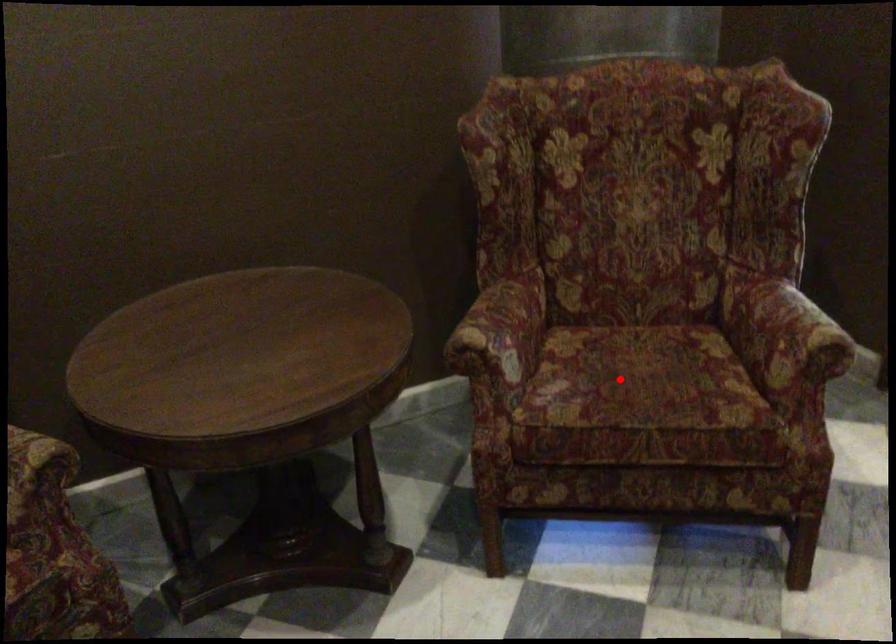
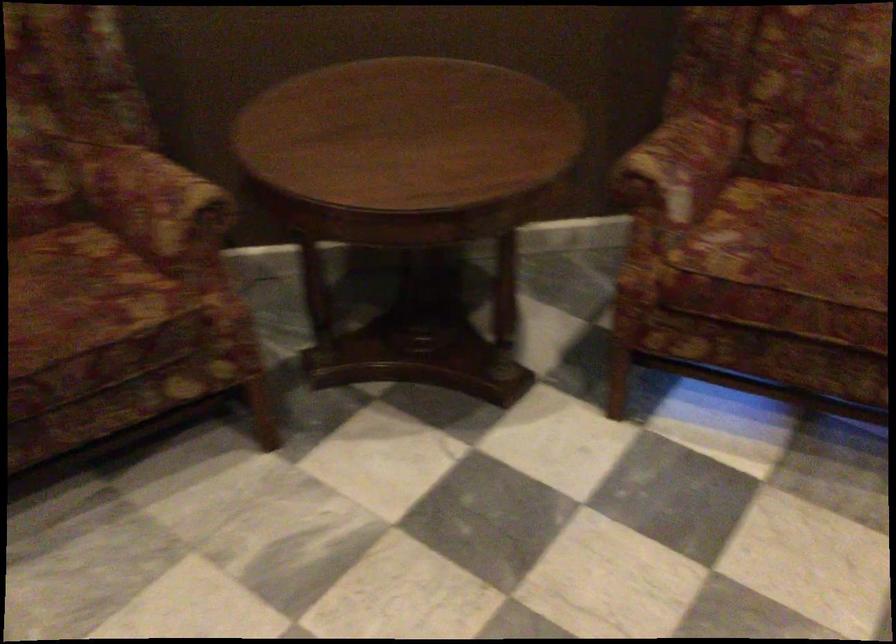
Find the pixel in the second image that matches the highlighted location in the first image.

(794, 243)